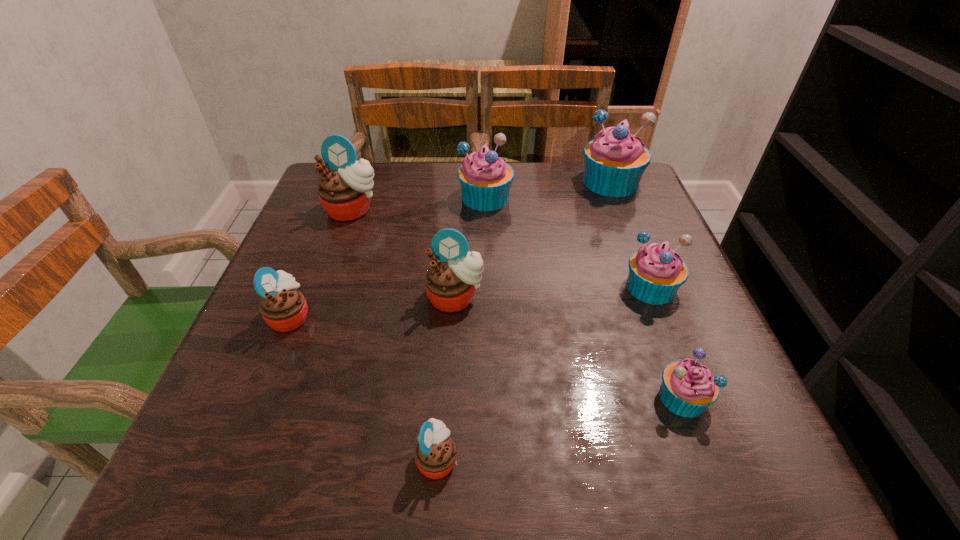
Where is `vacant space that satisfies the following two spatial constraints: 1. on the front-facing side of the farthest pink muffin; 2. on the front-facing side of the second smallest pink muffin`? Image resolution: width=960 pixels, height=540 pixels. vacant space that satisfies the following two spatial constraints: 1. on the front-facing side of the farthest pink muffin; 2. on the front-facing side of the second smallest pink muffin is located at coordinates (314, 316).

You are a GUI agent. You are given a task and a screenshot of the screen. Output one action in this format:
    pyautogui.click(x=<x>, y=<y>)
    Task: Click on the free location that satisfies the following two spatial constraints: 1. on the back side of the second nearest blue muffin; 2. on the left side of the biggest blue muffin
    The image size is (960, 540).
    Given the screenshot: What is the action you would take?
    pyautogui.click(x=610, y=182)

Image resolution: width=960 pixels, height=540 pixels. What are the coordinates of `vacant space that satisfies the following two spatial constraints: 1. on the front side of the leftmost blue muffin; 2. on the front-facing side of the smallest pink muffin` in the screenshot? It's located at (490, 458).